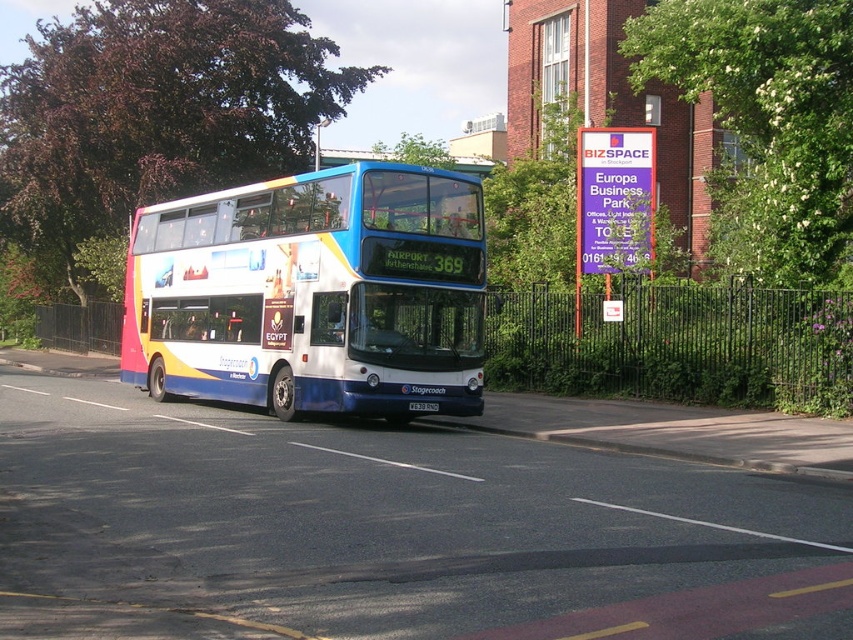
Between white glossy double-decker bus at center and silver metallic license plate at center, which one appears on the left side from the viewer's perspective?

white glossy double-decker bus at center is more to the left.

Does white glossy double-decker bus at center appear on the left side of silver metallic license plate at center?

Indeed, white glossy double-decker bus at center is positioned on the left side of silver metallic license plate at center.

Image resolution: width=853 pixels, height=640 pixels. Describe the element at coordinates (312, 292) in the screenshot. I see `white glossy double-decker bus at center` at that location.

Locate an element on the screen. white glossy double-decker bus at center is located at coordinates (312, 292).

Is the position of purple sign at upper center less distant than that of silver metallic license plate at center?

No, it is behind silver metallic license plate at center.

The height and width of the screenshot is (640, 853). What are the coordinates of `purple sign at upper center` in the screenshot? It's located at (613, 204).

Between point (602, 195) and point (424, 412), which one is positioned in front?

Positioned in front is point (424, 412).

Locate an element on the screen. purple sign at upper center is located at coordinates (613, 204).

Is point (236, 212) positioned in front of point (608, 131)?

Yes.

Is white glossy double-decker bus at center closer to camera compared to purple sign at upper center?

Yes, it is.

Where is `white glossy double-decker bus at center`? white glossy double-decker bus at center is located at coordinates (312, 292).

Locate an element on the screen. The width and height of the screenshot is (853, 640). white glossy double-decker bus at center is located at coordinates (312, 292).